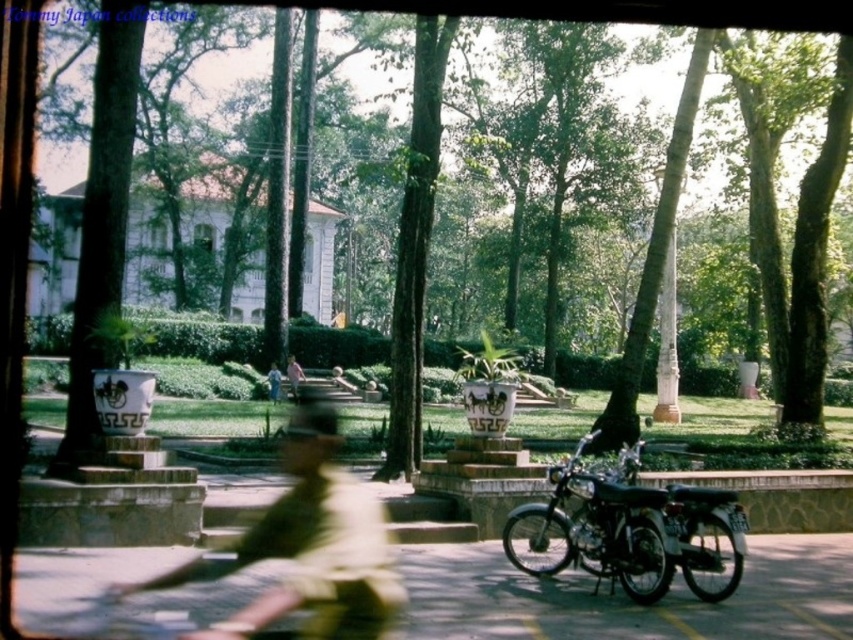
Can you confirm if green leafy tree at center is shorter than pink fabric dress at center?

Incorrect, green leafy tree at center's height does not fall short of pink fabric dress at center's.

Is point (619, 10) positioned before point (289, 356)?

That is True.

What do you see at coordinates (636, 10) in the screenshot? I see `green leafy tree at center` at bounding box center [636, 10].

Find the location of a particular element. green leafy tree at center is located at coordinates (636, 10).

Between shiny chrome motorcycle at center and pink fabric dress at center, which one appears on the right side from the viewer's perspective?

Positioned to the right is shiny chrome motorcycle at center.

The height and width of the screenshot is (640, 853). In order to click on shiny chrome motorcycle at center in this screenshot , I will do `click(625, 529)`.

Does point (677, 176) lie behind point (274, 401)?

No, it is not.

You are a GUI agent. You are given a task and a screenshot of the screen. Output one action in this format:
    pyautogui.click(x=<x>, y=<y>)
    Task: Click on the green leafy tree at center
    
    Given the screenshot: What is the action you would take?
    pyautogui.click(x=636, y=10)